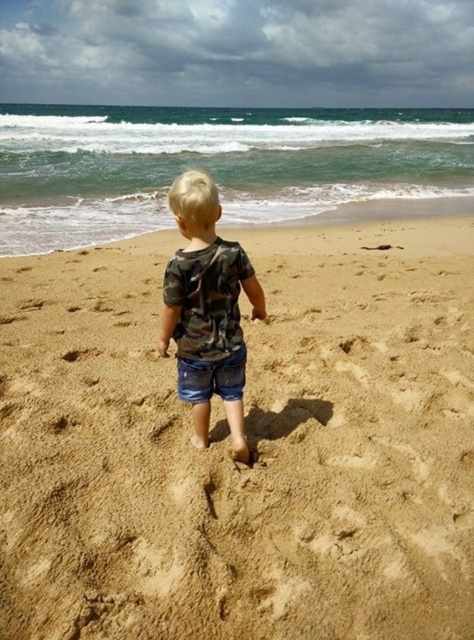
You are standing at the coordinates point 0.5, 0.5. You want to walk to the brown sandy beach at center. In which direction should you move?

The brown sandy beach at center is located at point [249,444], so you should move towards the right direction from your current position at [237,320].

You are a photographer trying to capture a wide shot of the beach scene. You want to ensure that both the brown sandy beach at center and the camo fabric shirt at center are clearly visible in the frame. Given their sizes, which object will occupy more space in the photo?

The brown sandy beach at center will occupy more space in the photo because its width is larger than that of the camo fabric shirt at center.

You are a photographer trying to capture the camo fabric shirt at center and the brown sandy beach at center in a single shot. Can you see both objects clearly in your camera frame?

The camo fabric shirt at center is behind the brown sandy beach at center, so the brown sandy beach at center will block the view of the camo fabric shirt at center in the camera frame.